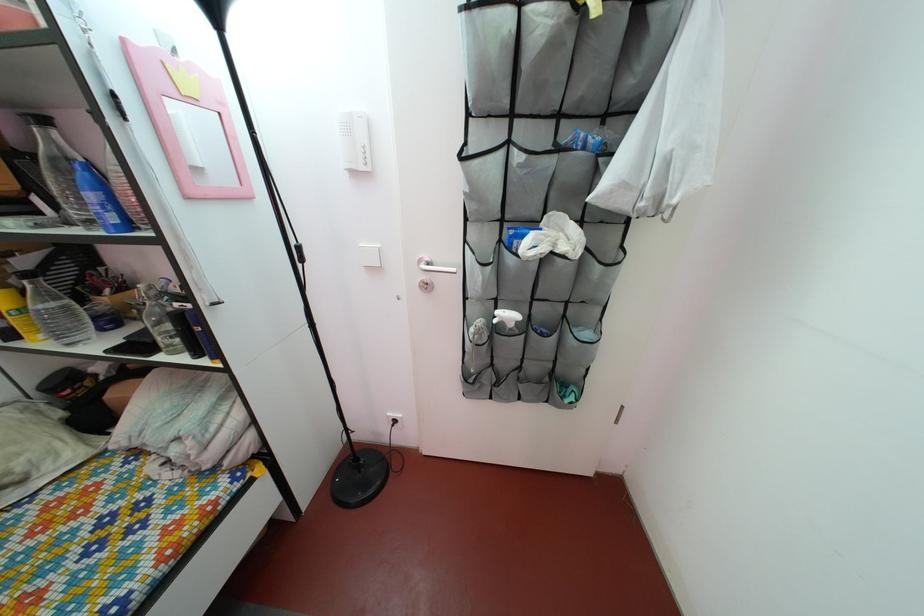
Find where to lift the dark water bottle. Please return your answer as a coordinate pair (x, y).

(159, 320)